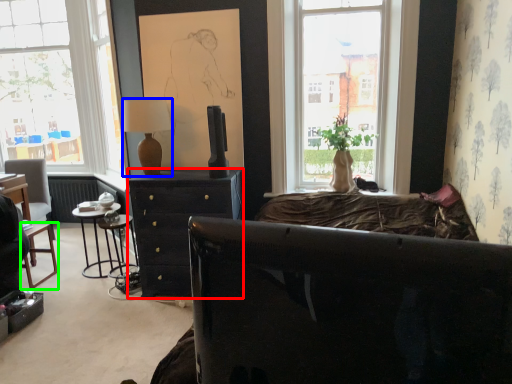
Question: Estimate the real-world distances between objects in this image. Which object is closer to desk (highlighted by a red box), lamp (highlighted by a blue box) or bar stool (highlighted by a green box)?

Choices:
 (A) lamp
 (B) bar stool

Answer: (A)